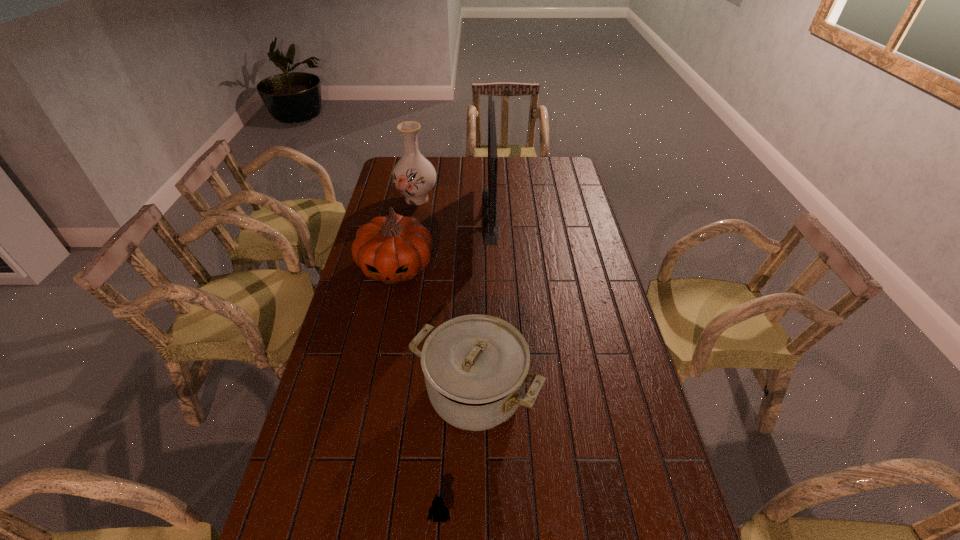
Locate an element on the screen. vacant space in between the pumpkin and the Lego is located at coordinates (419, 393).

The height and width of the screenshot is (540, 960). What are the coordinates of `free space that is in between the vase and the saucepan` in the screenshot? It's located at (446, 296).

The height and width of the screenshot is (540, 960). In order to click on free spot between the saucepan and the vase in this screenshot , I will do `click(446, 296)`.

Find the location of a particular element. vacant area that lies between the saucepan and the nearest object is located at coordinates (458, 456).

Identify the location of vacant space in between the shortest object and the saucepan. (458, 456).

The height and width of the screenshot is (540, 960). I want to click on free space between the second nearest object and the shortest object, so click(x=458, y=456).

Where is `free space that is in between the fourth tallest object and the vase`? This screenshot has width=960, height=540. free space that is in between the fourth tallest object and the vase is located at coordinates 446,296.

The image size is (960, 540). I want to click on the fourth closest object to the Lego, so click(414, 176).

Choose which object is the second nearest neighbor to the third shortest object. Please provide its 2D coordinates. Your answer should be formatted as a tuple, i.e. [(x, y)], where the tuple contains the x and y coordinates of a point satisfying the conditions above.

[(414, 176)]

You are a GUI agent. You are given a task and a screenshot of the screen. Output one action in this format:
    pyautogui.click(x=<x>, y=<y>)
    Task: Click on the free spot that satisfies the following two spatial constraints: 1. on the front-facing side of the monitor; 2. on the front-facing side of the nearest object
    The image size is (960, 540).
    Given the screenshot: What is the action you would take?
    pyautogui.click(x=498, y=518)